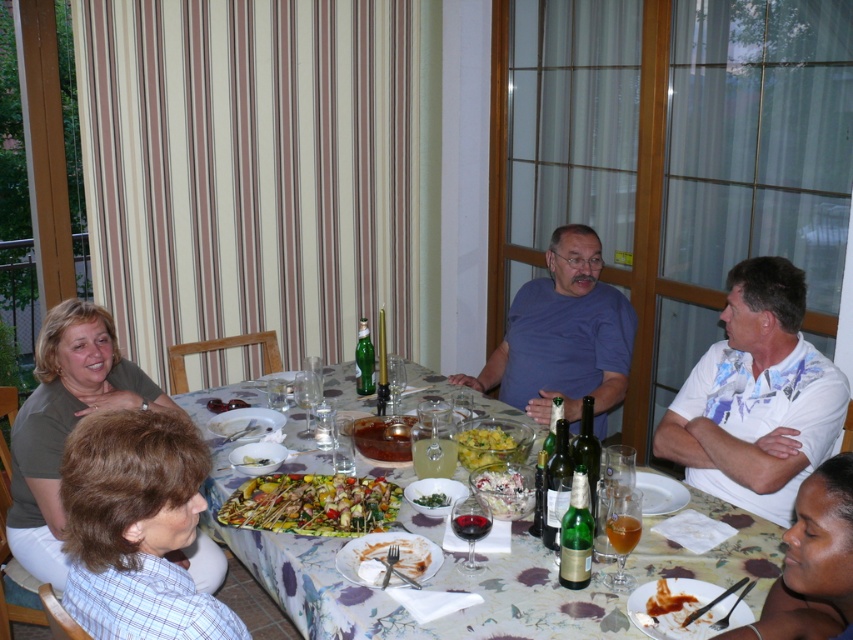
You are a photographer standing at the end of the dining table. You want to take a photo that includes both the white floral shirt at right and the green leafy salad at center. Which object should you ensure is closer to the camera to avoid it being cropped out of the frame?

The white floral shirt at right is much taller than the green leafy salad at center, so you should ensure the white floral shirt at right is closer to the camera to avoid it being cropped out of the frame.